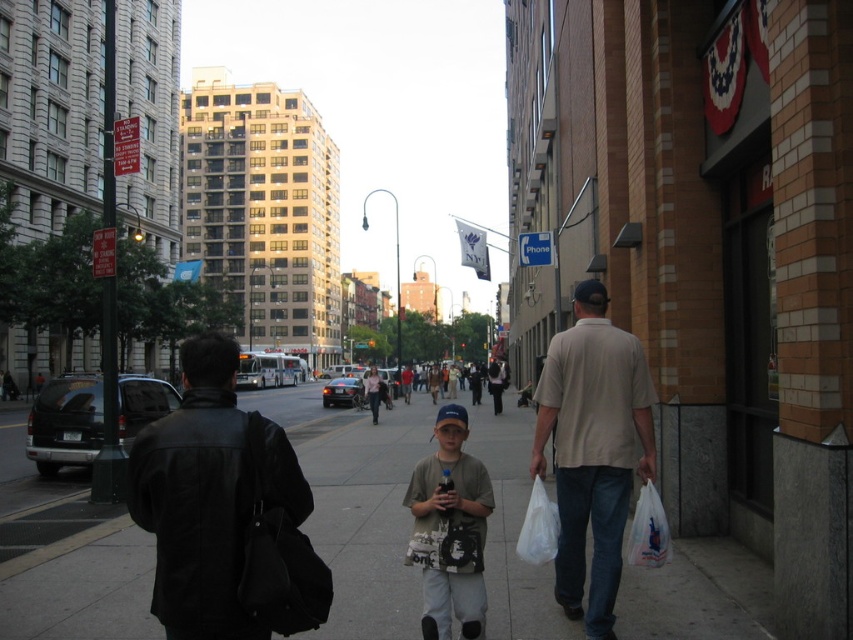
Is black leather jacket at left positioned at the back of beige cotton shirt at right?

No, black leather jacket at left is in front of beige cotton shirt at right.

Can you confirm if black leather jacket at left is bigger than beige cotton shirt at right?

Yes, black leather jacket at left is bigger than beige cotton shirt at right.

Which is behind, point (236, 541) or point (631, 438)?

Positioned behind is point (631, 438).

Where is `black leather jacket at left`? The image size is (853, 640). black leather jacket at left is located at coordinates pyautogui.click(x=224, y=512).

Which of these two, smooth concrete sidewalk at center or black leather jacket at left, stands taller?

Standing taller between the two is black leather jacket at left.

Does smooth concrete sidewalk at center have a larger size compared to black leather jacket at left?

Indeed, smooth concrete sidewalk at center has a larger size compared to black leather jacket at left.

Is point (141, 582) positioned before point (201, 333)?

That is True.

You are a GUI agent. You are given a task and a screenshot of the screen. Output one action in this format:
    pyautogui.click(x=<x>, y=<y>)
    Task: Click on the smooth concrete sidewalk at center
    The image size is (853, 640).
    Given the screenshot: What is the action you would take?
    coord(364,516)

Based on the photo, who is more distant from viewer, (628, 465) or (447, 474)?

Point (628, 465)

Is beige cotton shirt at right smaller than light gray cotton shirt at center?

No, beige cotton shirt at right is not smaller than light gray cotton shirt at center.

Between point (560, 605) and point (459, 506), which one is positioned in front?

Point (459, 506) is in front.

Find the location of a particular element. Image resolution: width=853 pixels, height=640 pixels. beige cotton shirt at right is located at coordinates (593, 449).